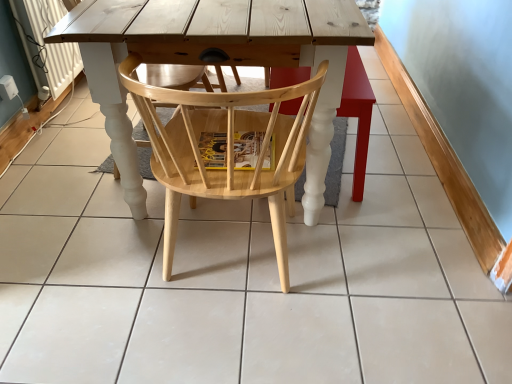
This screenshot has height=384, width=512. Identify the location of free spot below natural wood chair at center (from a real-world perspective). (229, 264).